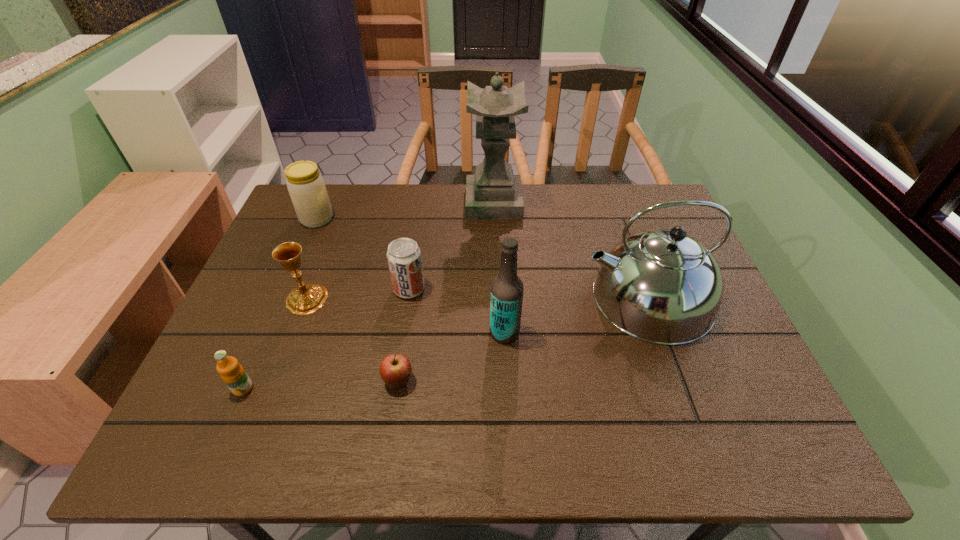
Find the location of a particular element. vacant point located between the second shortest object and the tallest object is located at coordinates (369, 296).

Image resolution: width=960 pixels, height=540 pixels. What are the coordinates of `vacant space that's between the soda can and the shortest object` in the screenshot? It's located at (404, 335).

The image size is (960, 540). In order to click on free spot between the kettle and the beer bottle in this screenshot , I will do `click(576, 315)`.

Image resolution: width=960 pixels, height=540 pixels. Find the location of `vacant area between the kettle and the sculpture`. vacant area between the kettle and the sculpture is located at coordinates (570, 251).

Locate an element on the screen. This screenshot has height=540, width=960. object that can be found as the closest to the jar is located at coordinates (306, 299).

Choose which object is the seventh nearest neighbor to the jar. Please provide its 2D coordinates. Your answer should be formatted as a tuple, i.e. [(x, y)], where the tuple contains the x and y coordinates of a point satisfying the conditions above.

[(661, 286)]

This screenshot has height=540, width=960. Find the location of `vacant space that satisfies the following two spatial constraints: 1. from the spout of the kettle; 2. on the front side of the apple`. vacant space that satisfies the following two spatial constraints: 1. from the spout of the kettle; 2. on the front side of the apple is located at coordinates (677, 381).

At what (x,y) coordinates should I click in order to perform the action: click on vacant area that satisfies the following two spatial constraints: 1. on the front side of the shortest object; 2. on the left side of the chalice. Please return your answer as a coordinate pair (x, y). Looking at the image, I should click on (276, 381).

This screenshot has height=540, width=960. What are the coordinates of `vacant region that satisfies the following two spatial constraints: 1. at the front opening of the tallest object; 2. on the label of the second shortest object` in the screenshot? It's located at (500, 388).

Find the location of a particular element. The width and height of the screenshot is (960, 540). vacant area in the image that satisfies the following two spatial constraints: 1. from the spout of the kettle; 2. on the front side of the shortest object is located at coordinates point(677,381).